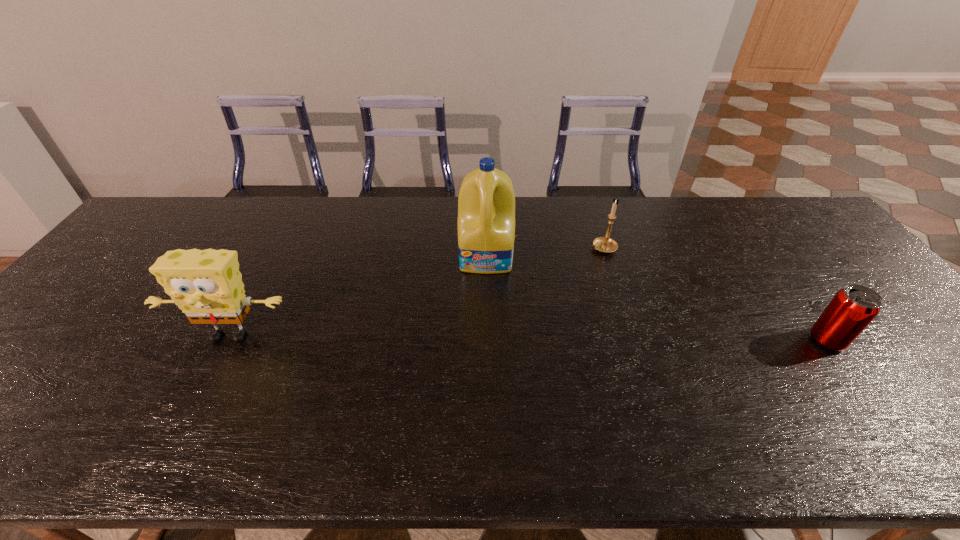
The image size is (960, 540). In order to click on free point between the leftmost object and the detergent in this screenshot , I will do `click(359, 296)`.

This screenshot has height=540, width=960. Identify the location of vacant space in between the third object from left to right and the third object from right to left. (545, 253).

The height and width of the screenshot is (540, 960). What are the coordinates of `free spot between the detergent and the second object from right to left` in the screenshot? It's located at (545, 253).

Identify the location of unoccupied area between the detergent and the sponge. (359, 296).

Find the location of a particular element. Image resolution: width=960 pixels, height=540 pixels. vacant point located between the rightmost object and the second tallest object is located at coordinates (529, 338).

Locate an element on the screen. The width and height of the screenshot is (960, 540). empty space between the soda can and the detergent is located at coordinates (658, 299).

Locate an element on the screen. Image resolution: width=960 pixels, height=540 pixels. vacant space in between the leftmost object and the rightmost object is located at coordinates (529, 338).

Find the location of a particular element. The height and width of the screenshot is (540, 960). free spot between the candle holder and the second object from left to right is located at coordinates (545, 253).

At what (x,y) coordinates should I click in order to perform the action: click on empty space between the rightmost object and the third object from right to left. Please return your answer as a coordinate pair (x, y). Image resolution: width=960 pixels, height=540 pixels. Looking at the image, I should click on (658, 299).

Locate which object ranks second in proximity to the soda can. Please provide its 2D coordinates. Your answer should be formatted as a tuple, i.e. [(x, y)], where the tuple contains the x and y coordinates of a point satisfying the conditions above.

[(486, 204)]